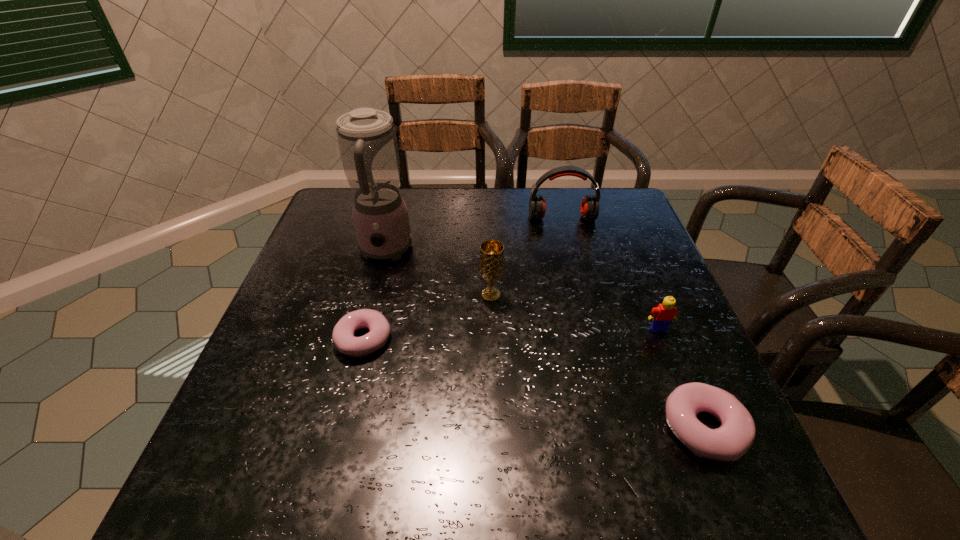
Identify the location of food processor that is at the left edge. (367, 141).

Where is `doughnut that is at the right edge`? doughnut that is at the right edge is located at coordinates (729, 442).

Identify the location of earphone that is at the right edge. (589, 209).

Locate an element on the screen. Lego that is at the right edge is located at coordinates (661, 316).

In order to click on object that is positioned at the far left corner in this screenshot , I will do `click(367, 141)`.

Where is `object located in the far right corner section of the desktop`? The width and height of the screenshot is (960, 540). object located in the far right corner section of the desktop is located at coordinates (589, 209).

The height and width of the screenshot is (540, 960). I want to click on object situated at the near right corner, so (x=729, y=442).

Locate an element on the screen. blank area at the far edge is located at coordinates (410, 214).

In order to click on vacant point at the near edge in this screenshot , I will do tap(451, 442).

You are a GUI agent. You are given a task and a screenshot of the screen. Output one action in this format:
    pyautogui.click(x=<x>, y=<y>)
    Task: Click on the free space at the left edge of the desktop
    The width and height of the screenshot is (960, 540).
    Given the screenshot: What is the action you would take?
    pyautogui.click(x=290, y=297)